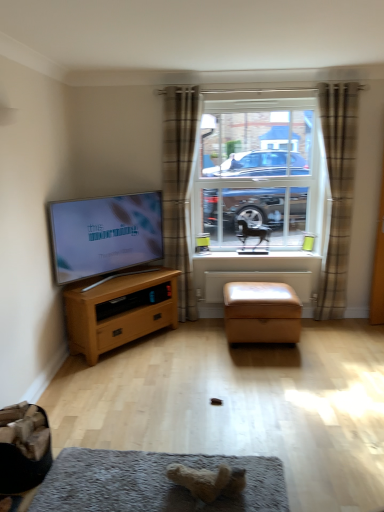
Question: Is wooden chest of drawers at left spatially inside soft gray carpet at lower center, or outside of it?

Choices:
 (A) inside
 (B) outside

Answer: (B)

Question: In terms of height, does wooden chest of drawers at left look taller or shorter compared to soft gray carpet at lower center?

Choices:
 (A) short
 (B) tall

Answer: (B)

Question: Estimate the real-world distances between objects in this image. Which object is closer to the soft gray carpet at lower center?

Choices:
 (A) satin tan ottoman at center
 (B) black glossy horse at center, which appears as the 1th animal when viewed from the back
 (C) brown plaid curtain at right, which is the 2th curtain from left to right
 (D) white painted wood at center
 (E) wooden chest of drawers at left

Answer: (E)

Question: Estimate the real-world distances between objects in this image. Which object is closer to the satin tan ottoman at center?

Choices:
 (A) wooden chest of drawers at left
 (B) white painted wood at center
 (C) black glossy horse at center, marked as the 2th animal in a left-to-right arrangement
 (D) plaid fabric curtain at center, the 2th curtain when ordered from right to left
 (E) matte black tv at left

Answer: (B)